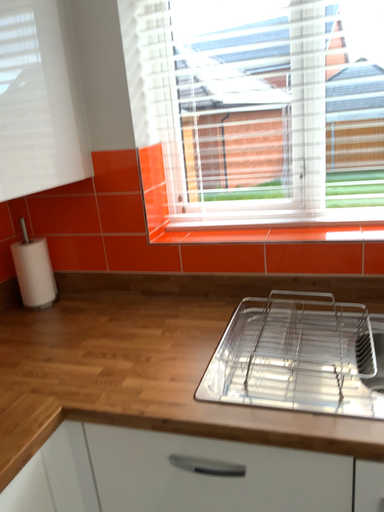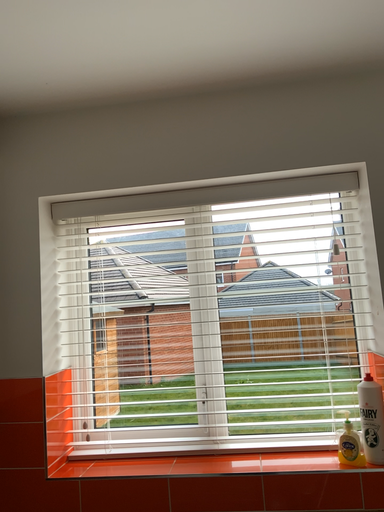
Question: How did the camera likely rotate when shooting the video?

Choices:
 (A) rotated upward
 (B) rotated downward

Answer: (A)